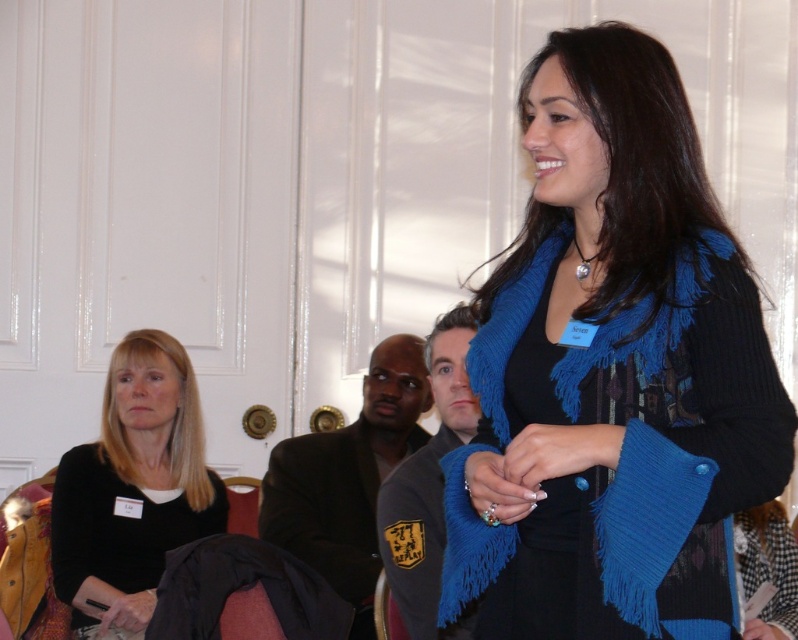
Question: Which object is farther from the camera taking this photo?

Choices:
 (A) black matte jacket at left
 (B) blue knitted scarf at center

Answer: (A)

Question: Can you confirm if blue knitted scarf at center is positioned below black matte jacket at left?

Choices:
 (A) yes
 (B) no

Answer: (B)

Question: Which point is farther to the camera?

Choices:
 (A) blue knitted scarf at center
 (B) black matte jacket at left

Answer: (B)

Question: Is blue knitted scarf at center positioned behind black matte jacket at left?

Choices:
 (A) no
 (B) yes

Answer: (A)

Question: Which point appears closest to the camera in this image?

Choices:
 (A) (477, 564)
 (B) (168, 410)

Answer: (A)

Question: Can you confirm if blue knitted scarf at center is smaller than black matte jacket at left?

Choices:
 (A) yes
 (B) no

Answer: (B)